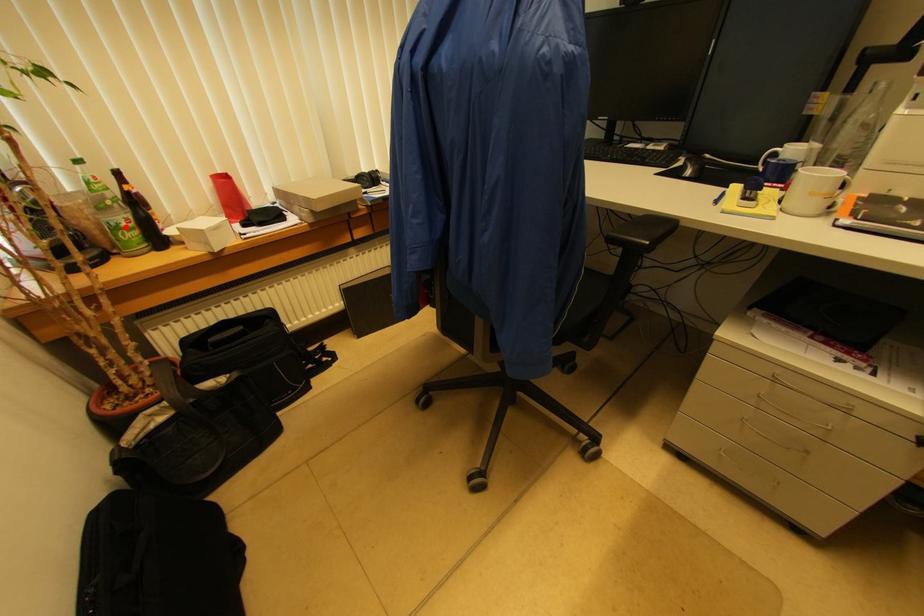
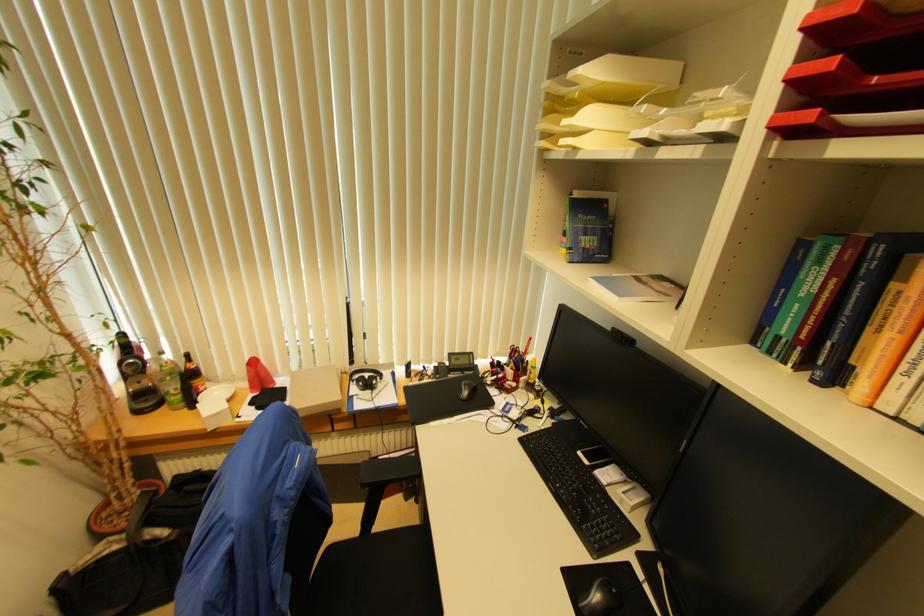
The point at the highlighted location is marked in the first image. Where is the corresponding point in the second image?

(174, 394)